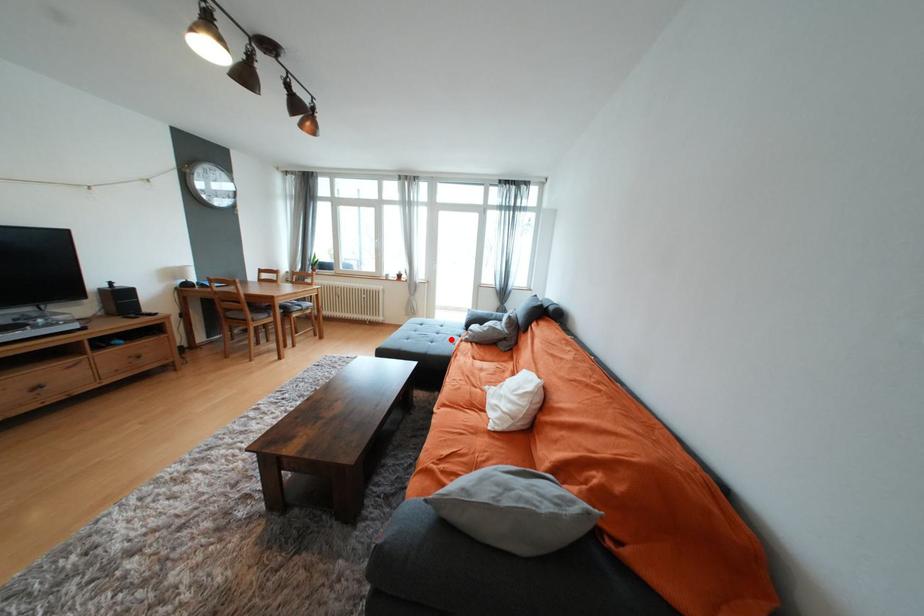
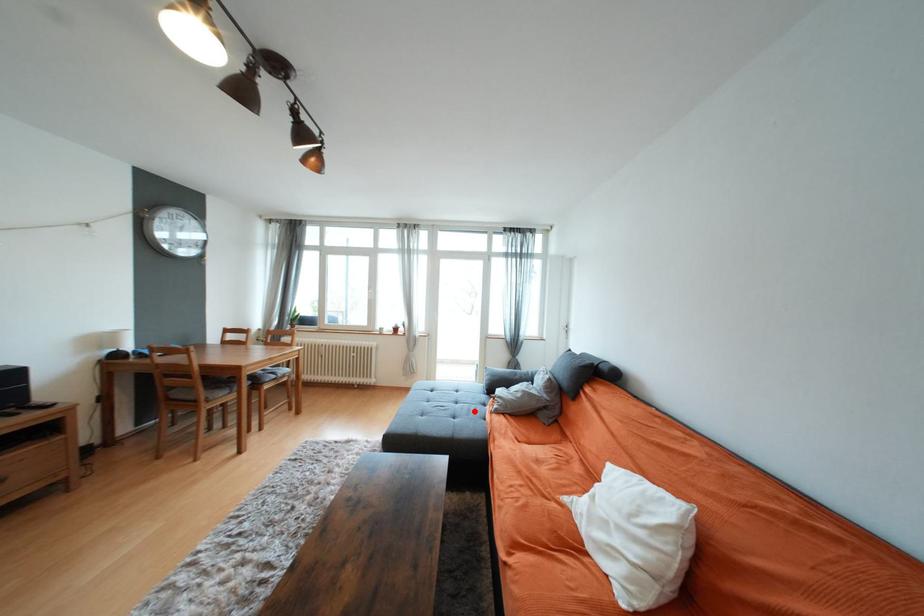
I am providing you with two images of the same scene from different viewpoints. A red point is marked on the first image and another point is marked on the second image. Do the highlighted points in image1 and image2 indicate the same real-world spot?

Yes